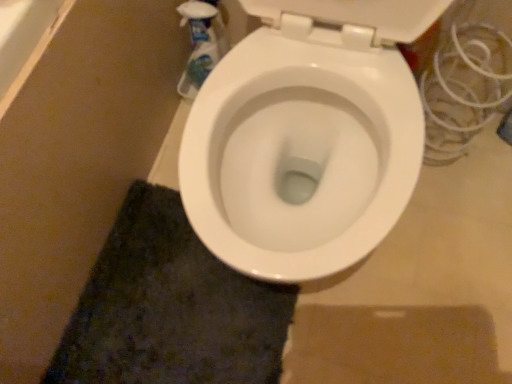
What is the approximate width of dark green shaggy carpet at lower left?

The width of dark green shaggy carpet at lower left is 17.12 inches.

What do you see at coordinates (170, 308) in the screenshot? I see `dark green shaggy carpet at lower left` at bounding box center [170, 308].

This screenshot has height=384, width=512. In order to click on dark green shaggy carpet at lower left in this screenshot , I will do `click(170, 308)`.

Describe the element at coordinates (201, 44) in the screenshot. The height and width of the screenshot is (384, 512). I see `translucent plastic spray bottle at upper left` at that location.

At what (x,y) coordinates should I click in order to perform the action: click on translucent plastic spray bottle at upper left. Please return your answer as a coordinate pair (x, y). The height and width of the screenshot is (384, 512). Looking at the image, I should click on (201, 44).

Identify the location of dark green shaggy carpet at lower left. This screenshot has height=384, width=512. (170, 308).

Between translucent plastic spray bottle at upper left and dark green shaggy carpet at lower left, which one appears on the right side from the viewer's perspective?

translucent plastic spray bottle at upper left is more to the right.

Which object is further away from the camera, translucent plastic spray bottle at upper left or dark green shaggy carpet at lower left?

translucent plastic spray bottle at upper left.

Is point (183, 15) more distant than point (279, 329)?

Yes, point (183, 15) is farther from viewer.

From the image's perspective, is translucent plastic spray bottle at upper left located above or below dark green shaggy carpet at lower left?

Clearly, from the image's perspective, translucent plastic spray bottle at upper left is above dark green shaggy carpet at lower left.

From a real-world perspective, between translucent plastic spray bottle at upper left and dark green shaggy carpet at lower left, who is vertically higher?

From a 3D spatial view, translucent plastic spray bottle at upper left is above.

Is translucent plastic spray bottle at upper left wider or thinner than dark green shaggy carpet at lower left?

Considering their sizes, translucent plastic spray bottle at upper left looks slimmer than dark green shaggy carpet at lower left.

Does translucent plastic spray bottle at upper left have a lesser height compared to dark green shaggy carpet at lower left?

Incorrect, the height of translucent plastic spray bottle at upper left does not fall short of that of dark green shaggy carpet at lower left.

Which of these two, translucent plastic spray bottle at upper left or dark green shaggy carpet at lower left, is smaller?

Smaller between the two is translucent plastic spray bottle at upper left.

Is translucent plastic spray bottle at upper left completely or partially outside of dark green shaggy carpet at lower left?

Absolutely, translucent plastic spray bottle at upper left is external to dark green shaggy carpet at lower left.

Does translucent plastic spray bottle at upper left touch dark green shaggy carpet at lower left?

No.

Is translucent plastic spray bottle at upper left aimed at dark green shaggy carpet at lower left?

No, translucent plastic spray bottle at upper left is not aimed at dark green shaggy carpet at lower left.

Can you tell me how much translucent plastic spray bottle at upper left and dark green shaggy carpet at lower left differ in facing direction?

92.8 degrees.

The image size is (512, 384). Find the location of `bath mat that is in front of the translucent plastic spray bottle at upper left`. bath mat that is in front of the translucent plastic spray bottle at upper left is located at coordinates (170, 308).

Between dark green shaggy carpet at lower left and translucent plastic spray bottle at upper left, which one appears on the right side from the viewer's perspective?

translucent plastic spray bottle at upper left.

Who is more distant, dark green shaggy carpet at lower left or translucent plastic spray bottle at upper left?

Positioned behind is translucent plastic spray bottle at upper left.

Which is behind, point (251, 278) or point (198, 74)?

Point (198, 74)

From the image's perspective, is dark green shaggy carpet at lower left on top of translucent plastic spray bottle at upper left?

No, from the image's perspective, dark green shaggy carpet at lower left is not above translucent plastic spray bottle at upper left.

From a real-world perspective, is dark green shaggy carpet at lower left physically located above or below translucent plastic spray bottle at upper left?

dark green shaggy carpet at lower left is below translucent plastic spray bottle at upper left.

Considering the relative sizes of dark green shaggy carpet at lower left and translucent plastic spray bottle at upper left in the image provided, is dark green shaggy carpet at lower left thinner than translucent plastic spray bottle at upper left?

No.

Which of these two, dark green shaggy carpet at lower left or translucent plastic spray bottle at upper left, stands shorter?

dark green shaggy carpet at lower left is shorter.

Who is smaller, dark green shaggy carpet at lower left or translucent plastic spray bottle at upper left?

With smaller size is translucent plastic spray bottle at upper left.

Is translucent plastic spray bottle at upper left completely or partially inside dark green shaggy carpet at lower left?

No, translucent plastic spray bottle at upper left is located outside of dark green shaggy carpet at lower left.

Is dark green shaggy carpet at lower left touching translucent plastic spray bottle at upper left?

They are not placed beside each other.

Is dark green shaggy carpet at lower left facing away from translucent plastic spray bottle at upper left?

dark green shaggy carpet at lower left is not turned away from translucent plastic spray bottle at upper left.

Locate an element on the screen. bath mat on the left of translucent plastic spray bottle at upper left is located at coordinates (170, 308).

In order to click on cleaning product behind the dark green shaggy carpet at lower left in this screenshot , I will do `click(201, 44)`.

The width and height of the screenshot is (512, 384). I want to click on bath mat located underneath the translucent plastic spray bottle at upper left (from a real-world perspective), so click(x=170, y=308).